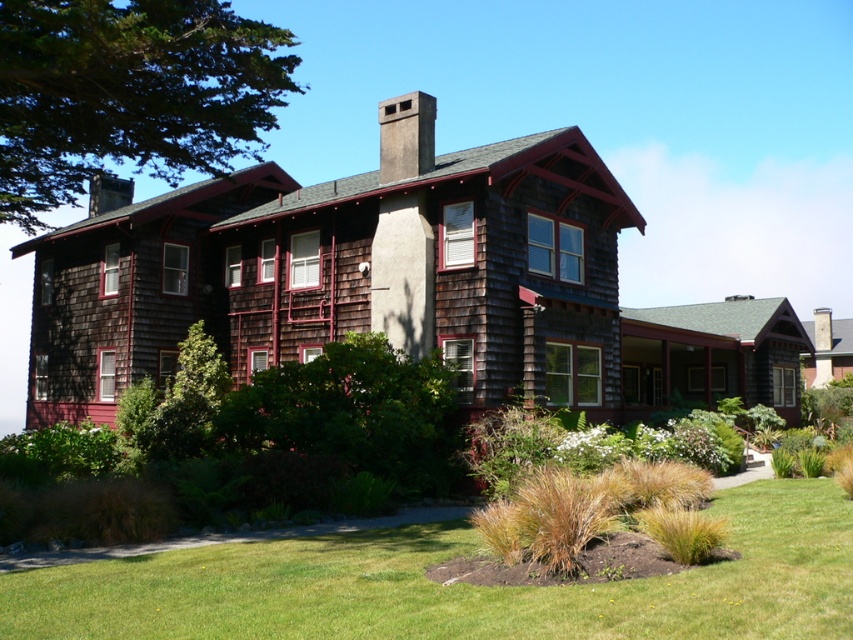
What do you see at coordinates (457, 586) in the screenshot?
I see `green grass at lower center` at bounding box center [457, 586].

Measure the distance between green grass at lower center and camera.

green grass at lower center and camera are 5.83 meters apart.

You are a GUI agent. You are given a task and a screenshot of the screen. Output one action in this format:
    pyautogui.click(x=<x>, y=<y>)
    Task: Click on the green grass at lower center
    
    Given the screenshot: What is the action you would take?
    tap(457, 586)

Can you confirm if green grass at lower center is wider than brown shingles at upper center?

Indeed, green grass at lower center has a greater width compared to brown shingles at upper center.

The image size is (853, 640). Describe the element at coordinates (457, 586) in the screenshot. I see `green grass at lower center` at that location.

Where is `green grass at lower center`? green grass at lower center is located at coordinates (457, 586).

Who is positioned more to the right, green grass at lower center or green leafy tree at upper left?

green grass at lower center is more to the right.

Is point (808, 563) farther from viewer compared to point (218, 28)?

That is False.

The image size is (853, 640). Identify the location of green grass at lower center. (457, 586).